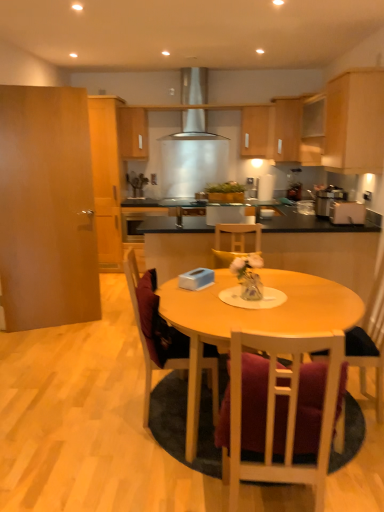
Question: Does point (369, 334) appear closer or farther from the camera than point (145, 117)?

Choices:
 (A) farther
 (B) closer

Answer: (B)

Question: Is wooden chair at right, the 3th chair viewed from the left, to the left or to the right of wooden cabinet at upper center, the sixth cabinetry from the right, in the image?

Choices:
 (A) right
 (B) left

Answer: (A)

Question: Which of these objects is positioned closest to the satin silver toaster at upper right, the second appliance viewed from the back?

Choices:
 (A) wooden chair at center, which is the 1th chair in left-to-right order
 (B) wooden cabinet at upper center, the fifth cabinetry when ordered from right to left
 (C) light wood table at center
 (D) brown wood door at left, placed as the 8th cabinetry when sorted from right to left
 (E) light wood cabinet at upper right, the seventh cabinetry positioned from the left

Answer: (E)

Question: Considering the real-world distances, which object is closest to the matte wood cabinet at upper center, placed as the fifth cabinetry when sorted from left to right?

Choices:
 (A) wooden cabinet at upper right, which appears as the 3th cabinetry when viewed from the right
 (B) light wood table at center
 (C) wooden cabinet at upper center, the fifth cabinetry when ordered from right to left
 (D) light brown wood cabinet at left, the 7th cabinetry when ordered from right to left
 (E) light wood cabinet at upper right, positioned as the 2th cabinetry in right-to-left order

Answer: (A)